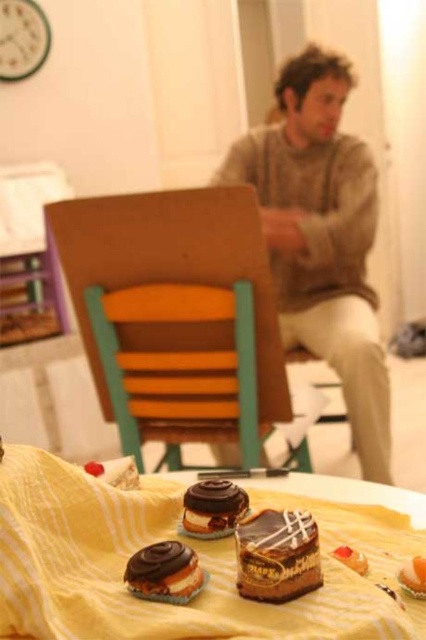
Question: Estimate the real-world distances between objects in this image. Which object is farther from the yellow fabric tablecloth at lower center?

Choices:
 (A) wooden chair at center
 (B) chocolate frosted cupcake at center
 (C) chocolate glazed donut at lower left
 (D) chocolate frosted cake at center

Answer: (A)

Question: Which of the following is the farthest from the observer?

Choices:
 (A) (308, 550)
 (B) (170, 582)
 (C) (203, 513)
 (D) (92, 301)

Answer: (D)

Question: Estimate the real-world distances between objects in this image. Which object is closer to the yellow fabric tablecloth at lower center?

Choices:
 (A) chocolate frosted cupcake at center
 (B) wooden chair at center
 (C) chocolate glazed donut at lower left
 (D) brown knitted sweater at upper center

Answer: (C)

Question: Does brown knitted sweater at upper center have a lesser width compared to chocolate frosted cake at center?

Choices:
 (A) yes
 (B) no

Answer: (B)

Question: From the image, what is the correct spatial relationship of chocolate glazed donut at lower left in relation to chocolate glazed donut at center?

Choices:
 (A) left
 (B) right

Answer: (A)

Question: Does chocolate frosted cake at center have a smaller size compared to chocolate glazed donut at center?

Choices:
 (A) yes
 (B) no

Answer: (B)